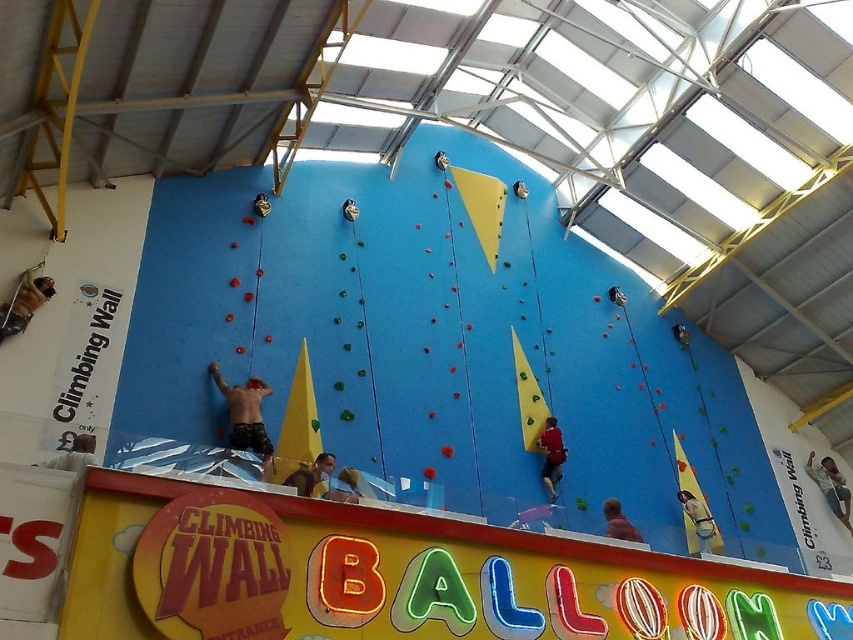
You are a climber preparing to ascend the blue climbing wall. You notice a matte yellow harness at center. Based on its position, can you determine if the harness is positioned near the base of the wall where you would typically start your climb?

The matte yellow harness at center is located at point coordinates that are closer to the bottom of the image, which typically corresponds to the base of the climbing wall. Therefore, the harness is likely positioned near the starting point for climbers.

You are a safety inspector checking the indoor climbing facility. You notice the matte yellow harness at center and the smooth skin person at center. According to safety regulations, the minimum safe distance between a harness and a climber should be at least 1 meter. Is the current distance compliant with the safety standards?

The distance between the matte yellow harness at center and the smooth skin person at center is 10.95 meters, which exceeds the minimum requirement of 1 meter. Therefore, it complies with the safety standards.